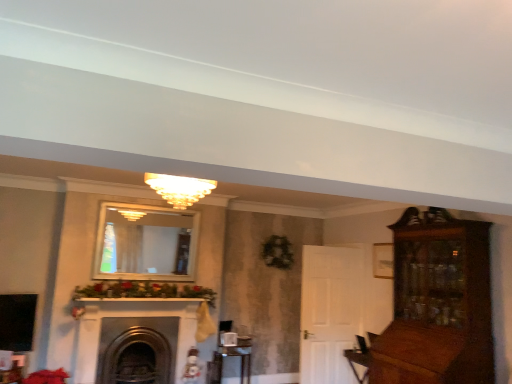
Question: From a real-world perspective, is dark gray stone fireplace at center located beneath metallic silver table at lower center?

Choices:
 (A) yes
 (B) no

Answer: (B)

Question: Is dark gray stone fireplace at center positioned far away from metallic silver table at lower center?

Choices:
 (A) no
 (B) yes

Answer: (A)

Question: Is metallic silver table at lower center a part of dark gray stone fireplace at center?

Choices:
 (A) no
 (B) yes

Answer: (A)

Question: Is dark gray stone fireplace at center bigger than metallic silver table at lower center?

Choices:
 (A) no
 (B) yes

Answer: (B)

Question: Is dark gray stone fireplace at center facing towards metallic silver table at lower center?

Choices:
 (A) no
 (B) yes

Answer: (A)

Question: Considering the positions of metallic silver table at lower center and matte glass chandelier at center in the image, is metallic silver table at lower center taller or shorter than matte glass chandelier at center?

Choices:
 (A) short
 (B) tall

Answer: (B)

Question: Is metallic silver table at lower center inside the boundaries of matte glass chandelier at center, or outside?

Choices:
 (A) inside
 (B) outside

Answer: (B)

Question: From the image's perspective, is metallic silver table at lower center located above or below matte glass chandelier at center?

Choices:
 (A) above
 (B) below

Answer: (B)

Question: From a real-world perspective, is metallic silver table at lower center above or below matte glass chandelier at center?

Choices:
 (A) above
 (B) below

Answer: (B)

Question: Visually, is matte glass chandelier at center positioned to the left or to the right of dark gray stone fireplace at center?

Choices:
 (A) right
 (B) left

Answer: (A)

Question: From the image's perspective, relative to dark gray stone fireplace at center, is matte glass chandelier at center above or below?

Choices:
 (A) below
 (B) above

Answer: (B)

Question: Is matte glass chandelier at center taller or shorter than dark gray stone fireplace at center?

Choices:
 (A) tall
 (B) short

Answer: (B)

Question: In terms of width, does matte glass chandelier at center look wider or thinner when compared to dark gray stone fireplace at center?

Choices:
 (A) wide
 (B) thin

Answer: (A)

Question: Would you say dark gray stone fireplace at center is inside or outside matte glass chandelier at center?

Choices:
 (A) inside
 (B) outside

Answer: (B)

Question: Considering the positions of point (109, 334) and point (188, 185), is point (109, 334) closer or farther from the camera than point (188, 185)?

Choices:
 (A) closer
 (B) farther

Answer: (B)